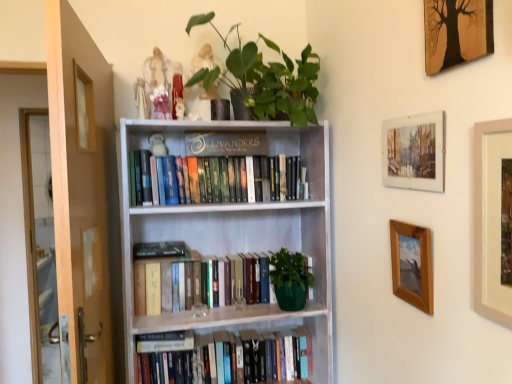
Question: Based on their positions, is green matte plant at upper center located to the left or right of wooden framed tree art at upper right, marked as the 1th picture frame in a top-to-bottom arrangement?

Choices:
 (A) left
 (B) right

Answer: (A)

Question: From a real-world perspective, relative to wooden framed tree art at upper right, which is counted as the 4th picture frame, starting from the bottom, is green matte plant at upper center vertically above or below?

Choices:
 (A) below
 (B) above

Answer: (B)

Question: Considering the real-world distances, which object is farthest from the hardcover books at center, marked as the 2th book in a bottom-to-top arrangement?

Choices:
 (A) green matte plant at upper center
 (B) wooden picture frame at right, which is the fourth picture frame in top-to-bottom order
 (C) hardcover books at upper center, which is the 1th book in top-to-bottom order
 (D) beige matte picture frame at upper right, the third picture frame in the top-to-bottom sequence
 (E) brown wooden screen door at left

Answer: (D)

Question: Which is farther from the hardcover books at center, marked as the 2th book in a bottom-to-top arrangement?

Choices:
 (A) white wooden bookcase at center
 (B) wooden framed tree art at upper right, which is counted as the 4th picture frame, starting from the bottom
 (C) green matte plant at upper center
 (D) beige matte picture frame at upper right, the 2th picture frame from the bottom
 (E) wooden picture frame at right, which is the fourth picture frame in top-to-bottom order

Answer: (B)